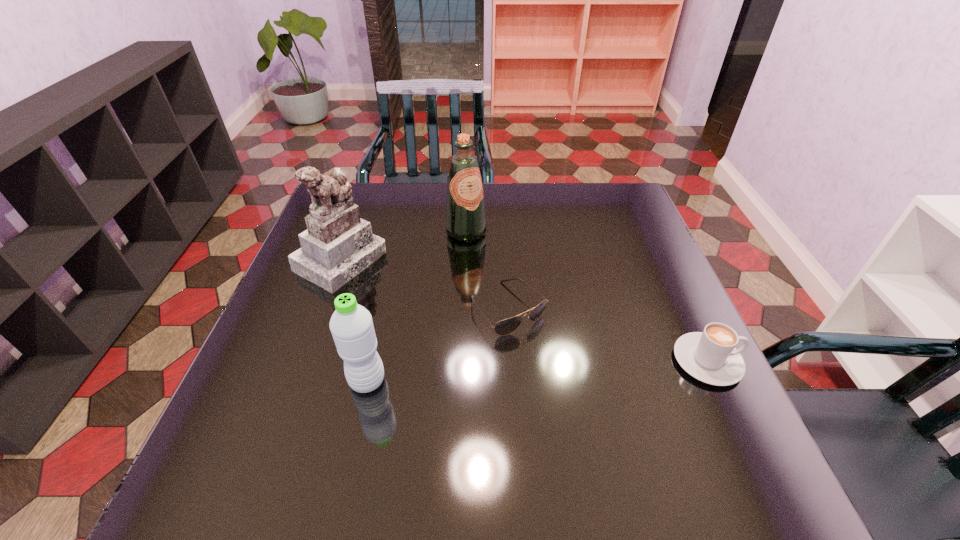
You are a GUI agent. You are given a task and a screenshot of the screen. Output one action in this format:
    pyautogui.click(x=<x>, y=<y>)
    Task: Click on the water bottle
    Image resolution: width=960 pixels, height=540 pixels.
    Given the screenshot: What is the action you would take?
    pyautogui.click(x=351, y=325)

The height and width of the screenshot is (540, 960). Identify the location of the fourth tallest object. (710, 356).

You are a GUI agent. You are given a task and a screenshot of the screen. Output one action in this format:
    pyautogui.click(x=<x>, y=<y>)
    Task: Click on the rightmost object
    The height and width of the screenshot is (540, 960).
    Given the screenshot: What is the action you would take?
    pyautogui.click(x=710, y=356)

This screenshot has width=960, height=540. Identify the location of olive oil. (465, 212).

Find the location of `the shortest object`. the shortest object is located at coordinates (504, 327).

Identify the location of figurine. (337, 245).

The width and height of the screenshot is (960, 540). I want to click on free location located 0.380m on the right of the third tallest object, so click(x=570, y=381).

At what (x,y) coordinates should I click in order to perform the action: click on vacant area located 0.280m on the front-facing side of the olive oil. Please return your answer as a coordinate pair (x, y). Image resolution: width=960 pixels, height=540 pixels. Looking at the image, I should click on (527, 305).

Image resolution: width=960 pixels, height=540 pixels. Identify the location of blank space located on the front-facing side of the olive oil. (483, 252).

Locate an element on the screen. Image resolution: width=960 pixels, height=540 pixels. vacant space located on the front-facing side of the olive oil is located at coordinates [x=502, y=276].